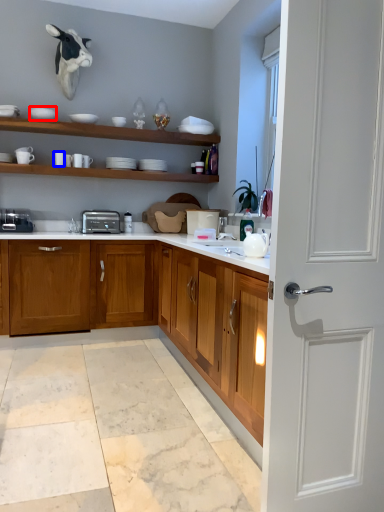
Question: Which point is further to the camera, tableware (highlighted by a red box) or tableware (highlighted by a blue box)?

Choices:
 (A) tableware
 (B) tableware

Answer: (B)